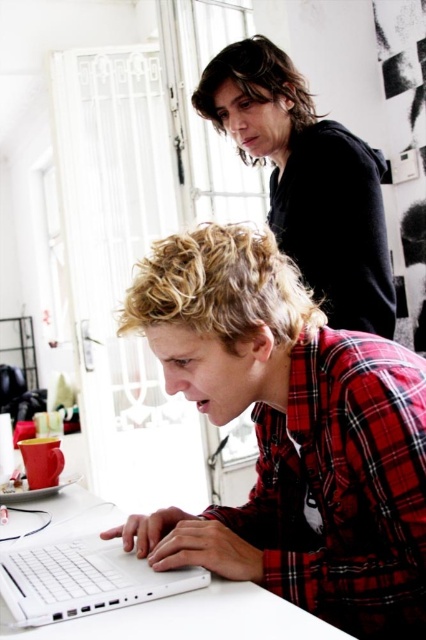
Question: Based on their relative distances, which object is nearer to the red plaid shirt at center?

Choices:
 (A) white matte laptop at lower left
 (B) black hoodie at upper center

Answer: (A)

Question: Does black hoodie at upper center appear under white matte laptop at lower left?

Choices:
 (A) yes
 (B) no

Answer: (B)

Question: Which object is the farthest from the red plaid shirt at center?

Choices:
 (A) white matte laptop at lower left
 (B) black hoodie at upper center

Answer: (B)

Question: Which of the following is the closest to the observer?

Choices:
 (A) white matte laptop at lower left
 (B) black hoodie at upper center
 (C) red plaid shirt at center

Answer: (A)

Question: Does red plaid shirt at center appear on the left side of white matte laptop at lower left?

Choices:
 (A) no
 (B) yes

Answer: (A)

Question: Is black hoodie at upper center above white matte laptop at lower left?

Choices:
 (A) yes
 (B) no

Answer: (A)